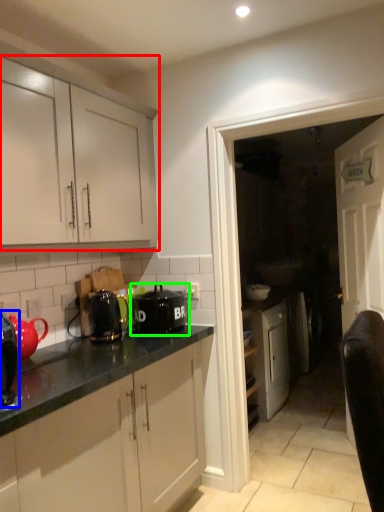
Question: Considering the real-world distances, which object is closest to cabinetry (highlighted by a red box)? kitchen appliance (highlighted by a blue box) or kitchen appliance (highlighted by a green box).

Choices:
 (A) kitchen appliance
 (B) kitchen appliance

Answer: (B)